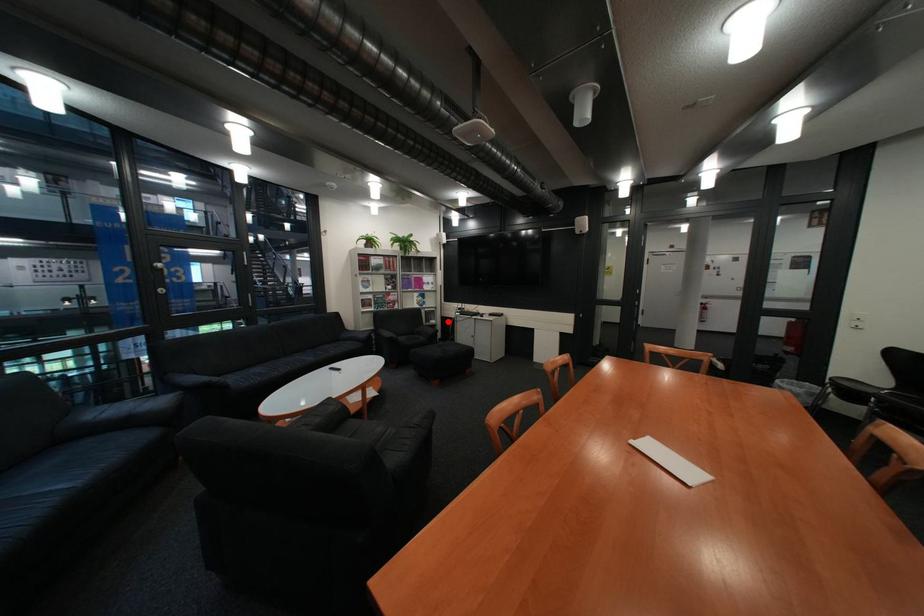
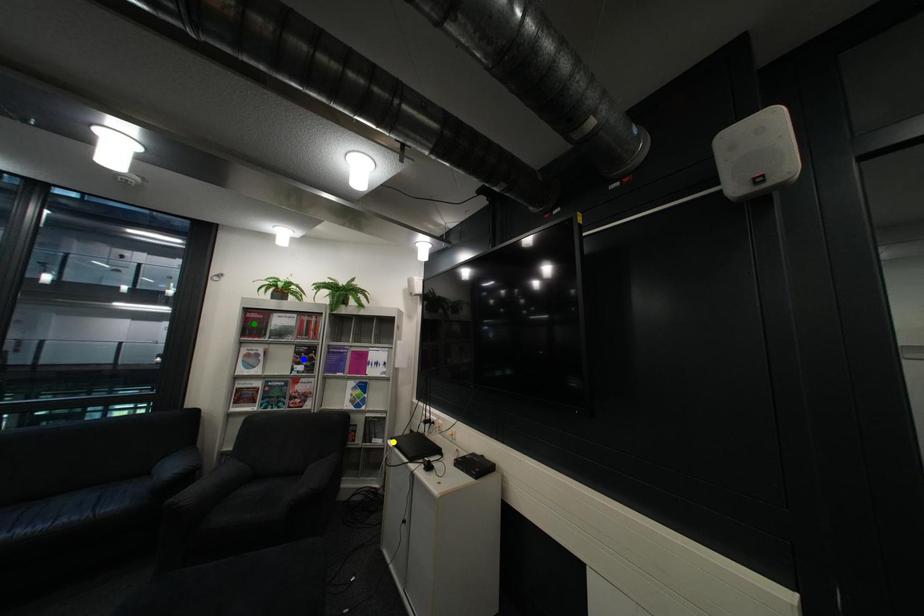
Question: I am providing you with two images of the same scene from different viewpoints. A red point is marked on the first image. You are given multiple points on the second image. Which spot in image 2 lines up with the point in image 1?

Choices:
 (A) green point
 (B) yellow point
 (C) blue point

Answer: (B)